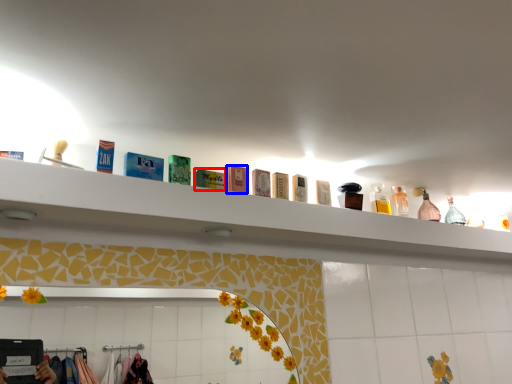
Question: Which of the following is the closest to the observer, toiletry (highlighted by a red box) or toiletry (highlighted by a blue box)?

Choices:
 (A) toiletry
 (B) toiletry

Answer: (A)